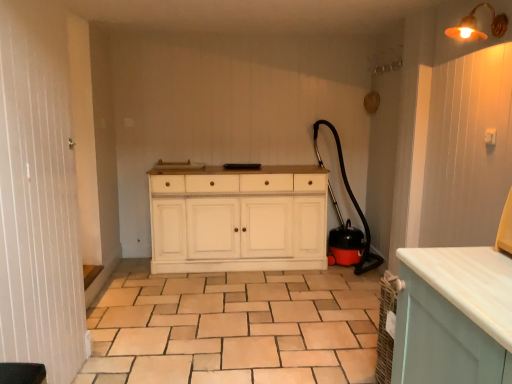
The image size is (512, 384). I want to click on vacant region in front of black rubber garden hose at right, so click(x=335, y=291).